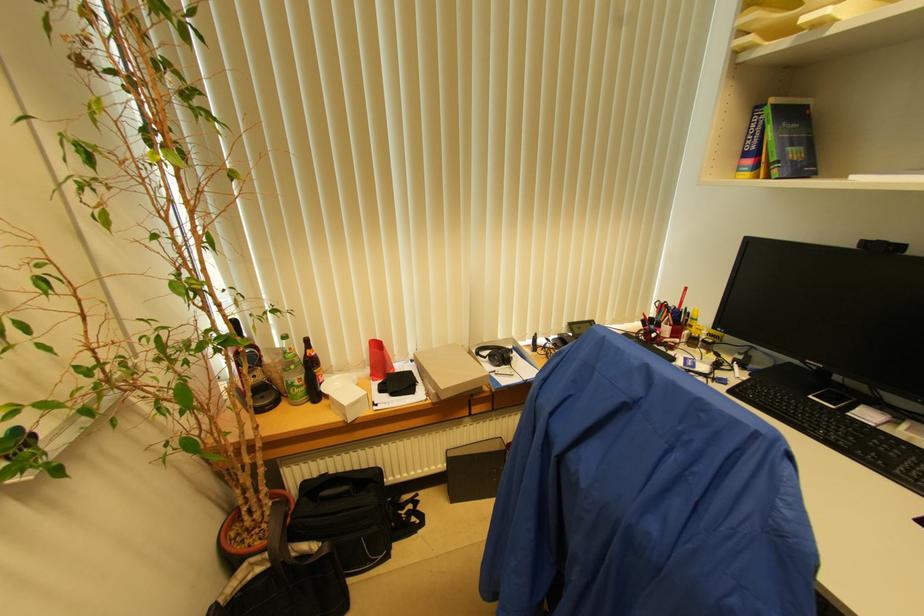
Which object does [310,373] point to?

This point indicates the brown glass bottle.